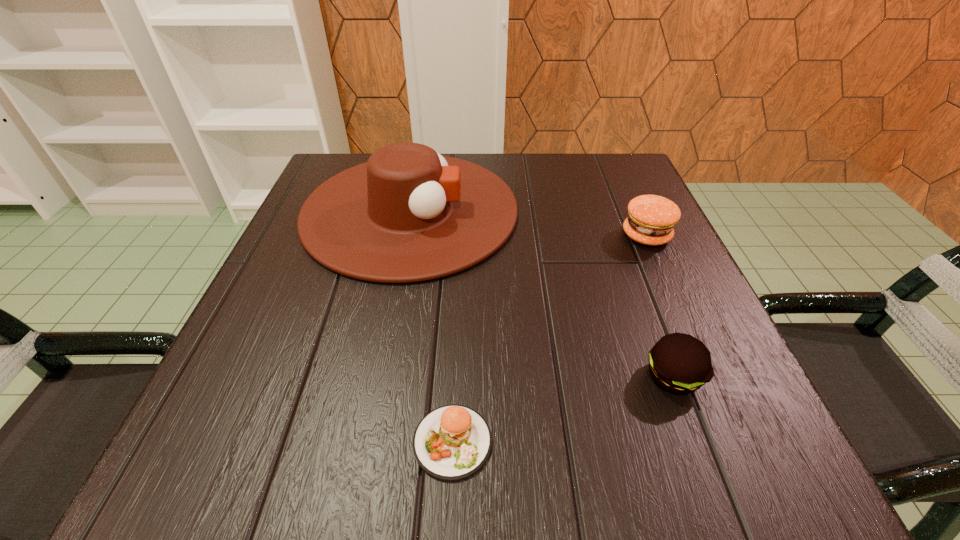
At what (x,y) coordinates should I click in order to perform the action: click on vacant space that's between the farthest patty and the shortest object. Please return your answer as a coordinate pair (x, y). This screenshot has width=960, height=540. Looking at the image, I should click on (549, 339).

This screenshot has height=540, width=960. Identify the location of free space between the farthest patty and the tallest object. (528, 223).

Locate an element on the screen. The image size is (960, 540). vacant space that's between the farthest patty and the second nearest patty is located at coordinates (660, 306).

The image size is (960, 540). In order to click on vacant space in between the farthest patty and the cowboy hat in this screenshot , I will do `click(528, 223)`.

Identify the location of free spot between the nearest patty and the second nearest object. Image resolution: width=960 pixels, height=540 pixels. (563, 409).

Locate an element on the screen. The width and height of the screenshot is (960, 540). free point between the farthest patty and the second nearest object is located at coordinates (660, 306).

Find the location of a particular element. free space between the tallest object and the farthest patty is located at coordinates (528, 223).

Identify the location of free point between the third farthest object and the farthest patty. (660, 306).

I want to click on free area in between the shortest object and the cowboy hat, so click(431, 326).

Where is `the closest object relative to the second nearest patty`? The height and width of the screenshot is (540, 960). the closest object relative to the second nearest patty is located at coordinates (409, 214).